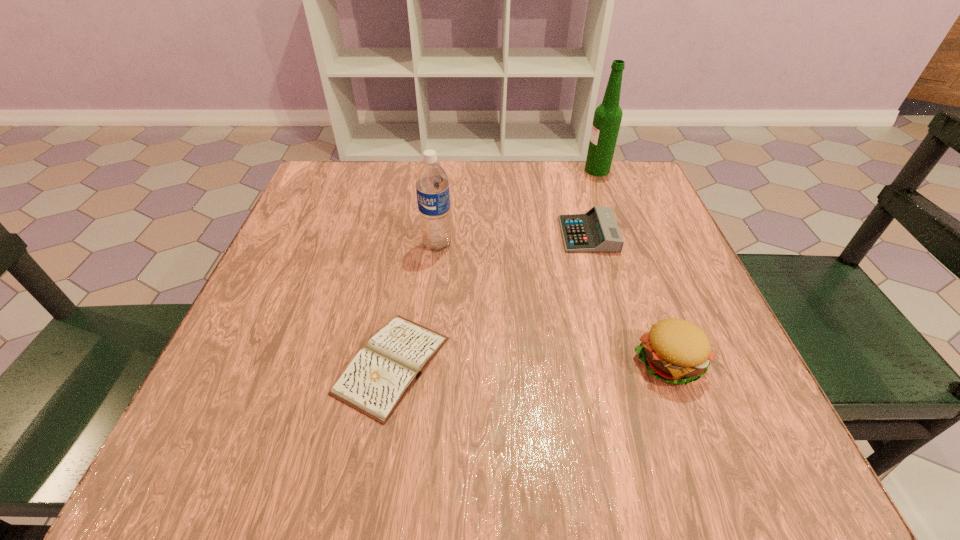
The height and width of the screenshot is (540, 960). I want to click on vacant region between the second shortest object and the fourth shortest object, so click(513, 239).

At what (x,y) coordinates should I click in order to perform the action: click on empty location between the fourth shortest object and the farthest object. Please return your answer as a coordinate pair (x, y). Looking at the image, I should click on (517, 207).

Identify the location of empty space between the diary and the water bottle. (415, 305).

Image resolution: width=960 pixels, height=540 pixels. What are the coordinates of `free space between the third tallest object and the farthest object` in the screenshot? It's located at (633, 266).

Where is `free space between the fourth shortest object and the hamburger`? Image resolution: width=960 pixels, height=540 pixels. free space between the fourth shortest object and the hamburger is located at coordinates (553, 303).

Locate which object ranks in proximity to the water bottle. Please provide its 2D coordinates. Your answer should be formatted as a tuple, i.e. [(x, y)], where the tuple contains the x and y coordinates of a point satisfying the conditions above.

[(379, 376)]

Locate which object ranks second in proximity to the diary. Please provide its 2D coordinates. Your answer should be formatted as a tuple, i.e. [(x, y)], where the tuple contains the x and y coordinates of a point satisfying the conditions above.

[(595, 231)]

This screenshot has height=540, width=960. In order to click on vacant position in the image that satisfies the following two spatial constraints: 1. on the back side of the fourth shortest object; 2. on the left side of the second shortest object in this screenshot , I will do `click(439, 234)`.

Find the location of `blank space that satisfies the following two spatial constraints: 1. on the back side of the water bottle; 2. on the right side of the shortest object`. blank space that satisfies the following two spatial constraints: 1. on the back side of the water bottle; 2. on the right side of the shortest object is located at coordinates (413, 245).

In order to click on free spot that satisfies the following two spatial constraints: 1. on the label of the beer bottle; 2. on the back side of the hamburger in this screenshot , I will do `click(667, 361)`.